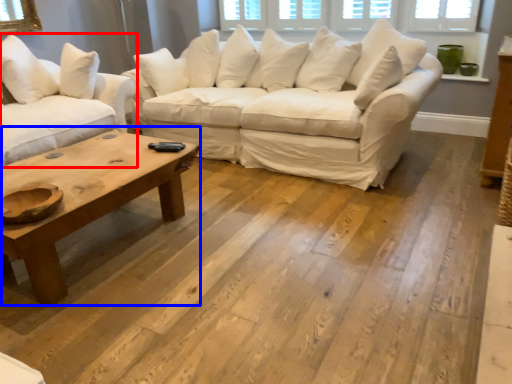
Question: Which object is closer to the camera taking this photo, studio couch (highlighted by a red box) or coffee table (highlighted by a blue box)?

Choices:
 (A) studio couch
 (B) coffee table

Answer: (B)